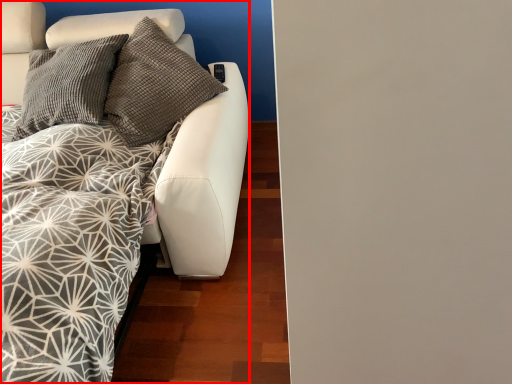
Question: From the image, what is the correct spatial relationship of furniture (annotated by the red box) in relation to backdrop?

Choices:
 (A) left
 (B) right

Answer: (A)